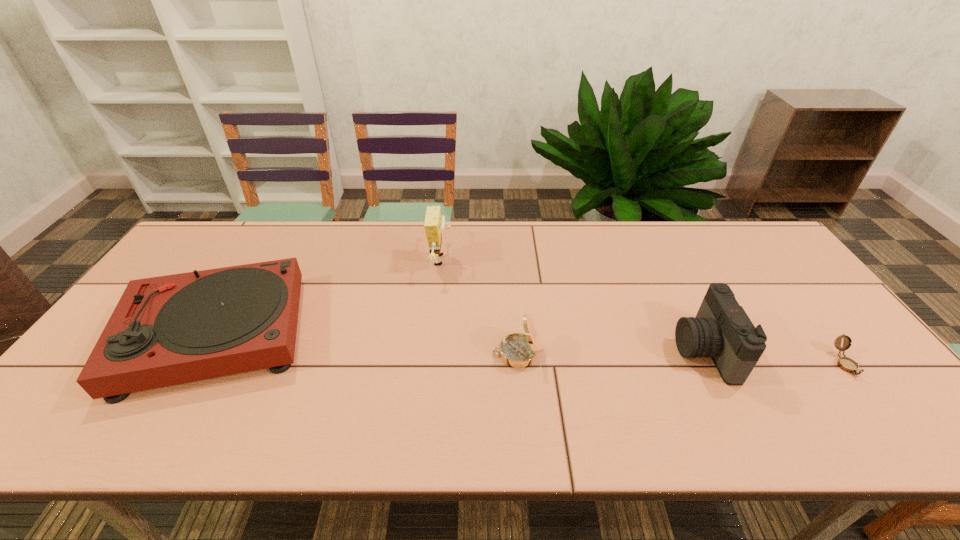
Locate an element on the screen. This screenshot has width=960, height=540. vacant region between the third object from left to right and the tallest object is located at coordinates (478, 307).

Find the location of `vacant space that's between the shorter compass and the fourth object from right to left`. vacant space that's between the shorter compass and the fourth object from right to left is located at coordinates (643, 312).

The height and width of the screenshot is (540, 960). Find the location of `free space between the second object from right to left and the shorter compass`. free space between the second object from right to left and the shorter compass is located at coordinates (775, 357).

This screenshot has width=960, height=540. In order to click on vacant point located between the left compass and the fourth shortest object in this screenshot , I will do `click(610, 352)`.

This screenshot has width=960, height=540. What are the coordinates of `vacant space that's between the record player and the third object from left to right` in the screenshot? It's located at (366, 343).

Point out which object is positioned as the second nearest to the record player. Please provide its 2D coordinates. Your answer should be formatted as a tuple, i.e. [(x, y)], where the tuple contains the x and y coordinates of a point satisfying the conditions above.

[(518, 350)]

At what (x,y) coordinates should I click in order to perform the action: click on the second closest object to the record player. Please return your answer as a coordinate pair (x, y). Looking at the image, I should click on (518, 350).